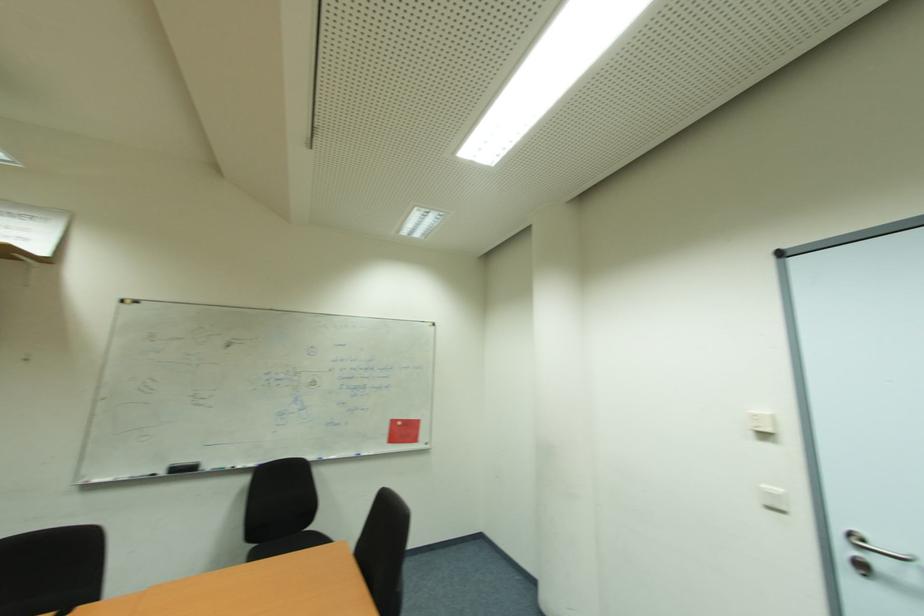
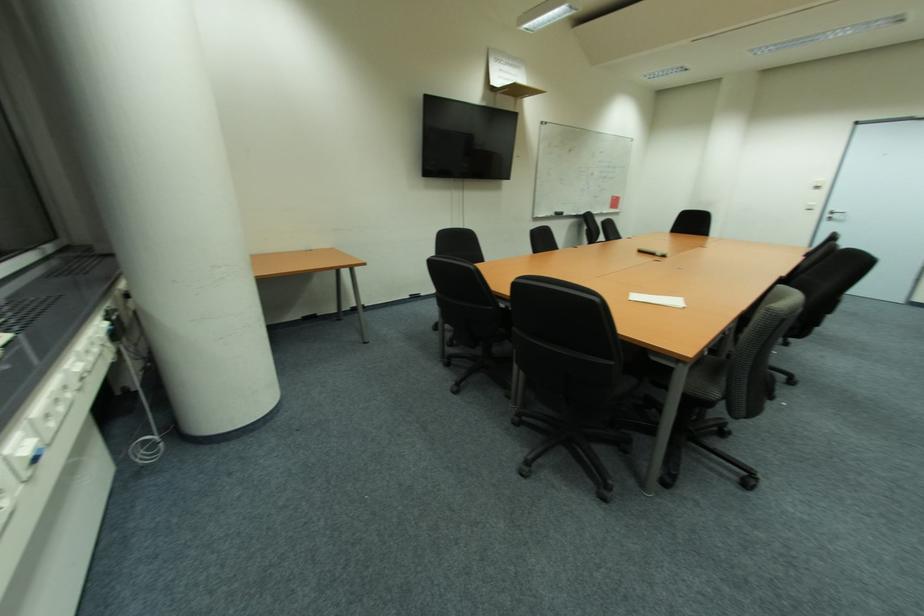
The point at (883, 564) is marked in the first image. Where is the corresponding point in the second image?

(842, 217)